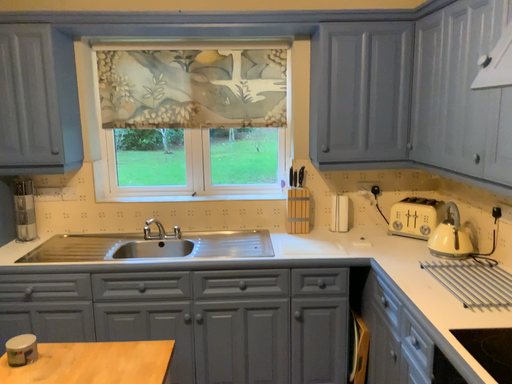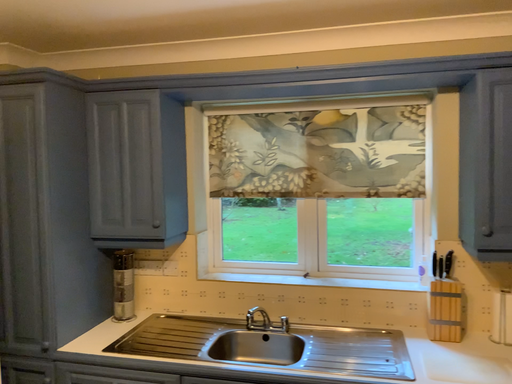
Question: How did the camera likely rotate when shooting the video?

Choices:
 (A) rotated upward
 (B) rotated downward

Answer: (A)